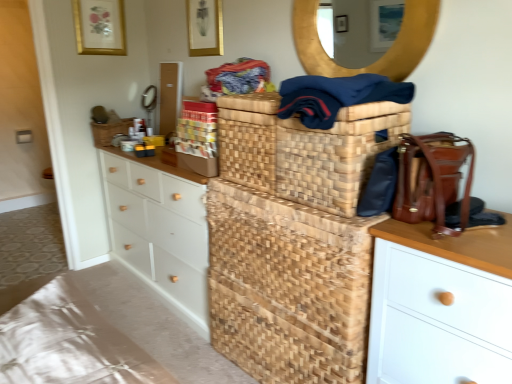
Where is `natural woven basket at center`? natural woven basket at center is located at coordinates (288, 287).

Measure the distance between point (290, 254) and camera.

A distance of 5.07 feet exists between point (290, 254) and camera.

Identify the location of beige textured fabric at lower left. The height and width of the screenshot is (384, 512). (70, 343).

Find the location of a particular element. natural woven basket at center, positioned as the first basket in right-to-left order is located at coordinates (304, 150).

Image resolution: width=512 pixels, height=384 pixels. Describe the element at coordinates (205, 27) in the screenshot. I see `matte gold picture frame at upper center, acting as the 1th picture frame starting from the right` at that location.

In order to face matte gold picture frame at upper center, arranged as the 1th picture frame when viewed from the back, should I rotate leftwards or rightwards?

Rotate left and turn 19.975 degrees.

Measure the distance between point [99,37] and camera.

Point [99,37] is 9.17 feet from camera.

I want to click on natural woven basket at center, so click(x=288, y=287).

Is point (387, 85) positioned after point (205, 308)?

No, it is in front of (205, 308).

Would you consider navy blue fabric at upper center to be distant from white matte chest of drawers at left?

Yes, navy blue fabric at upper center is far from white matte chest of drawers at left.

Is navy blue fabric at upper center oriented towards white matte chest of drawers at left?

No, navy blue fabric at upper center is not aimed at white matte chest of drawers at left.

Which object is closer to the camera taking this photo, navy blue fabric at upper center or white matte chest of drawers at left?

Positioned in front is navy blue fabric at upper center.

Is matte gold picture frame at upper center, acting as the 1th picture frame starting from the right, wider or thinner than navy blue fabric at upper center?

matte gold picture frame at upper center, acting as the 1th picture frame starting from the right, is thinner than navy blue fabric at upper center.

Is point (219, 3) more distant than point (395, 93)?

Yes, point (219, 3) is behind point (395, 93).

Considering their positions, is matte gold picture frame at upper center, which is the second picture frame from back to front, located in front of or behind navy blue fabric at upper center?

Clearly, matte gold picture frame at upper center, which is the second picture frame from back to front, is behind navy blue fabric at upper center.

Visually, is matte gold picture frame at upper center, which is the second picture frame from back to front, positioned to the left or to the right of navy blue fabric at upper center?

In the image, matte gold picture frame at upper center, which is the second picture frame from back to front, appears on the left side of navy blue fabric at upper center.

Where is `clothing on the right of natural woven basket at center`? The width and height of the screenshot is (512, 384). clothing on the right of natural woven basket at center is located at coordinates (336, 96).

Which object is wider, natural woven basket at center or navy blue fabric at upper center?

With larger width is natural woven basket at center.

Which object is closer to the camera, natural woven basket at center or navy blue fabric at upper center?

navy blue fabric at upper center.

Is point (338, 307) positioned after point (301, 78)?

No, (338, 307) is closer to viewer.

From the image's perspective, which object appears higher, natural woven basket at center, arranged as the 1th basket when viewed from the front, or woven brown basket at center, placed as the 1th basket when sorted from top to bottom?

woven brown basket at center, placed as the 1th basket when sorted from top to bottom.

Considering the positions of objects natural woven basket at center, the 1th basket from the bottom, and woven brown basket at center, the 2th basket positioned from the front, in the image provided, who is in front, natural woven basket at center, the 1th basket from the bottom, or woven brown basket at center, the 2th basket positioned from the front,?

natural woven basket at center, the 1th basket from the bottom, is closer to the camera.

From their relative heights in the image, would you say natural woven basket at center, marked as the second basket in a back-to-front arrangement, is taller or shorter than woven brown basket at center, placed as the second basket when sorted from right to left?

natural woven basket at center, marked as the second basket in a back-to-front arrangement, is taller than woven brown basket at center, placed as the second basket when sorted from right to left.

Could you tell me if natural woven basket at center, which ranks as the second basket in top-to-bottom order, is facing natural woven basket at center?

No, natural woven basket at center, which ranks as the second basket in top-to-bottom order, is not turned towards natural woven basket at center.

Is natural woven basket at center, arranged as the 1th basket when viewed from the front, located outside natural woven basket at center?

Absolutely, natural woven basket at center, arranged as the 1th basket when viewed from the front, is external to natural woven basket at center.

Can you confirm if natural woven basket at center, which ranks as the second basket in top-to-bottom order, is positioned to the left of natural woven basket at center?

Incorrect, natural woven basket at center, which ranks as the second basket in top-to-bottom order, is not on the left side of natural woven basket at center.

Can you confirm if natural woven basket at center, positioned as the first basket in right-to-left order, is bigger than natural woven basket at center?

No, natural woven basket at center, positioned as the first basket in right-to-left order, is not bigger than natural woven basket at center.

From the image's perspective, is white matte chest of drawers at left over navy blue fabric at upper center?

Incorrect, from the image's perspective, white matte chest of drawers at left is lower than navy blue fabric at upper center.

Can you confirm if white matte chest of drawers at left is taller than navy blue fabric at upper center?

Yes, white matte chest of drawers at left is taller than navy blue fabric at upper center.

Can you tell me how much white matte chest of drawers at left and navy blue fabric at upper center differ in facing direction?

0.69 degrees.

Considering their positions, is natural woven basket at center, the 1th basket from the bottom, located in front of or behind white matte chest of drawers at left?

In the image, natural woven basket at center, the 1th basket from the bottom, appears in front of white matte chest of drawers at left.

Is natural woven basket at center, which is the second basket from left to right, placed right next to white matte chest of drawers at left?

There is a gap between natural woven basket at center, which is the second basket from left to right, and white matte chest of drawers at left.

Identify the location of the chest of drawers behind the natural woven basket at center, arranged as the 1th basket when viewed from the front. The image size is (512, 384). (159, 230).

From a real-world perspective, which object rests below the other?

white matte chest of drawers at left, from a real-world perspective.

Identify the location of clothing in front of the white matte chest of drawers at left. (336, 96).

The height and width of the screenshot is (384, 512). Find the location of `clothing lying on the right of matte gold picture frame at upper center, which is the second picture frame from back to front`. clothing lying on the right of matte gold picture frame at upper center, which is the second picture frame from back to front is located at coordinates (336, 96).

Looking at the image, which one is located closer to natural woven basket at center, beige textured fabric at lower left or white matte chest of drawers at left?

white matte chest of drawers at left is closer to natural woven basket at center.

Based on their spatial positions, is navy blue fabric at upper center or natural woven basket at center closer to matte gold picture frame at upper center, arranged as the second picture frame when viewed from the left?

Based on the image, navy blue fabric at upper center appears to be nearer to matte gold picture frame at upper center, arranged as the second picture frame when viewed from the left.

Based on their spatial positions, is woven brown basket at center, placed as the second basket when sorted from right to left, or natural woven basket at center closer to white matte chest of drawers at left?

natural woven basket at center is closer to white matte chest of drawers at left.

When comparing their distances from navy blue fabric at upper center, does natural woven basket at center or natural woven basket at center, marked as the second basket in a back-to-front arrangement, seem closer?

natural woven basket at center, marked as the second basket in a back-to-front arrangement, lies closer to navy blue fabric at upper center than the other object.

From the image, which object appears to be nearer to beige textured fabric at lower left, natural woven basket at center or white matte chest of drawers at left?

natural woven basket at center is positioned closer to the anchor beige textured fabric at lower left.

Considering their positions, is natural woven basket at center, which is the second basket from left to right, positioned closer to woven brown basket at center, the 2th basket when ordered from bottom to top, than beige textured fabric at lower left?

natural woven basket at center, which is the second basket from left to right, is closer to woven brown basket at center, the 2th basket when ordered from bottom to top.

Estimate the real-world distances between objects in this image. Which object is further from matte gold picture frame at upper center, positioned as the second picture frame in right-to-left order, navy blue fabric at upper center or matte gold picture frame at upper center, which is the second picture frame from back to front?

Among the two, navy blue fabric at upper center is located further to matte gold picture frame at upper center, positioned as the second picture frame in right-to-left order.

Considering their positions, is navy blue fabric at upper center positioned closer to natural woven basket at center, the 1th basket from the bottom, than woven brown basket at center, placed as the second basket when sorted from right to left?

navy blue fabric at upper center is positioned closer to the anchor natural woven basket at center, the 1th basket from the bottom.

Find the location of `picture frame that lies between matte gold picture frame at upper center, arranged as the 1th picture frame when viewed from the back, and white matte chest of drawers at left from top to bottom`. picture frame that lies between matte gold picture frame at upper center, arranged as the 1th picture frame when viewed from the back, and white matte chest of drawers at left from top to bottom is located at coordinates (205, 27).

The height and width of the screenshot is (384, 512). Identify the location of crate located between white matte chest of drawers at left and navy blue fabric at upper center in the left-right direction. (288, 287).

The height and width of the screenshot is (384, 512). I want to click on crate located between beige textured fabric at lower left and natural woven basket at center, positioned as the first basket in right-to-left order, in the left-right direction, so (288, 287).

At what (x,y) coordinates should I click in order to perform the action: click on crate between beige textured fabric at lower left and navy blue fabric at upper center in the horizontal direction. Please return your answer as a coordinate pair (x, y). The width and height of the screenshot is (512, 384). Looking at the image, I should click on (288, 287).